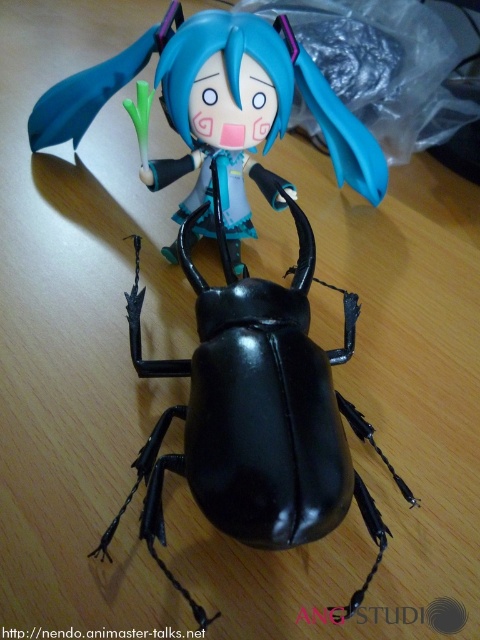
Question: Which point is farther to the camera?

Choices:
 (A) (356, 429)
 (B) (134, 49)

Answer: (B)

Question: Which point appears closest to the camera in this image?

Choices:
 (A) (224, 442)
 (B) (141, 150)

Answer: (A)

Question: Does black glossy beetle at center have a greater width compared to glossy black beetle at center?

Choices:
 (A) yes
 (B) no

Answer: (B)

Question: Is black glossy beetle at center to the right of glossy black beetle at center from the viewer's perspective?

Choices:
 (A) yes
 (B) no

Answer: (A)

Question: Which point appears closest to the camera in this image?

Choices:
 (A) (230, 429)
 (B) (168, 164)

Answer: (A)

Question: Is black glossy beetle at center above glossy black beetle at center?

Choices:
 (A) no
 (B) yes

Answer: (A)